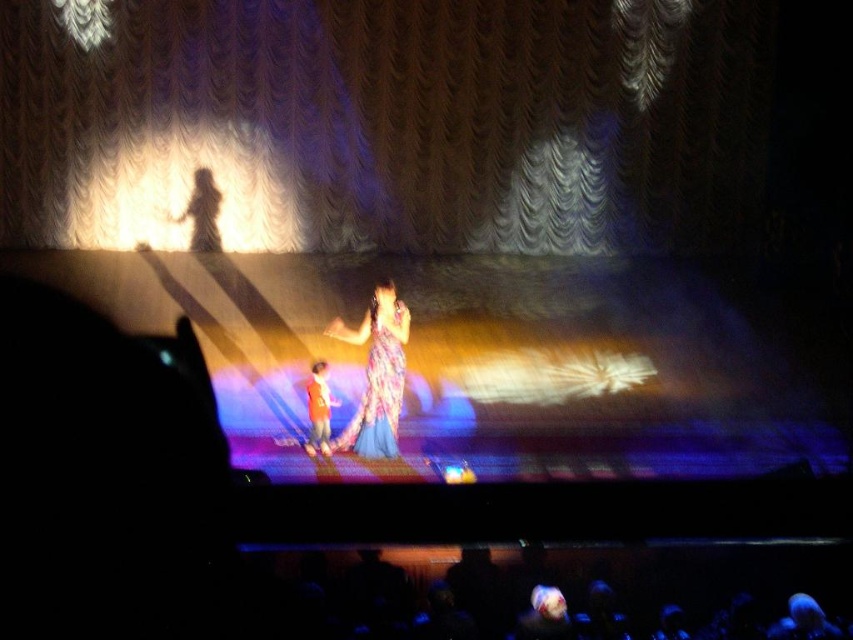
You are an audience member sitting in the front row of the stage. You notice a point at coordinates (376,387) on the stage. What object is located at that point?

The floral chiffon dress at center is located at point (376,387).